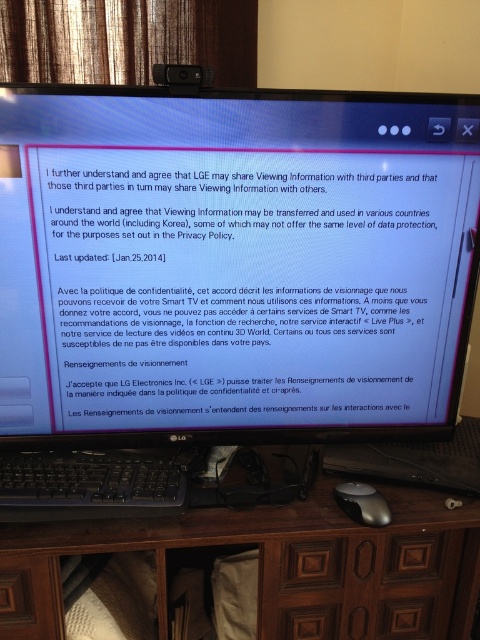
Question: Which of the following is the farthest from the observer?

Choices:
 (A) (76, 499)
 (B) (360, 483)
 (C) (123, 308)

Answer: (B)

Question: Is white paper at center thinner than black plastic keyboard at lower center?

Choices:
 (A) no
 (B) yes

Answer: (A)

Question: Which of these objects is positioned farthest from the black plastic keyboard at lower center?

Choices:
 (A) brown wood computer desk at center
 (B) satin silver mouse at lower center

Answer: (B)

Question: Estimate the real-world distances between objects in this image. Which object is farther from the black plastic keyboard at lower center?

Choices:
 (A) brown wood computer desk at center
 (B) satin silver mouse at lower center
 (C) white paper at center

Answer: (B)

Question: Is black plastic keyboard at lower center to the left of satin silver mouse at lower center from the viewer's perspective?

Choices:
 (A) no
 (B) yes

Answer: (B)

Question: Where is black plastic keyboard at lower center located in relation to satin silver mouse at lower center in the image?

Choices:
 (A) right
 (B) left

Answer: (B)